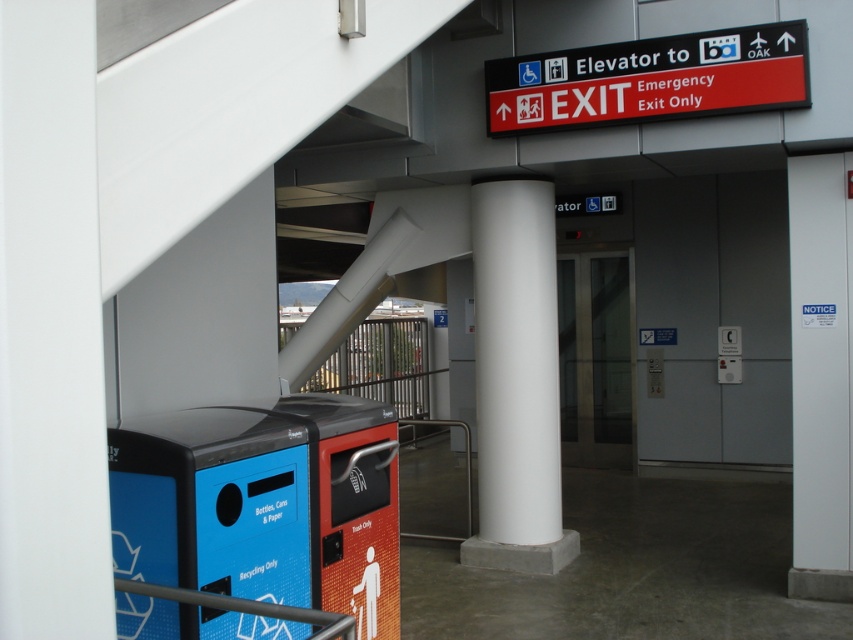
Question: Is the position of white smooth column at center less distant than that of red plastic sign at upper right?

Choices:
 (A) no
 (B) yes

Answer: (A)

Question: Can you confirm if white smooth column at center is wider than red plastic sign at upper right?

Choices:
 (A) no
 (B) yes

Answer: (A)

Question: Which of the following is the farthest from the observer?

Choices:
 (A) (544, 83)
 (B) (483, 285)

Answer: (B)

Question: Among these points, which one is nearest to the camera?

Choices:
 (A) (680, 67)
 (B) (511, 225)

Answer: (A)

Question: Which object appears farthest from the camera in this image?

Choices:
 (A) white smooth column at center
 (B) red plastic sign at upper right

Answer: (A)

Question: Can you confirm if white smooth column at center is positioned above red plastic sign at upper right?

Choices:
 (A) no
 (B) yes

Answer: (A)